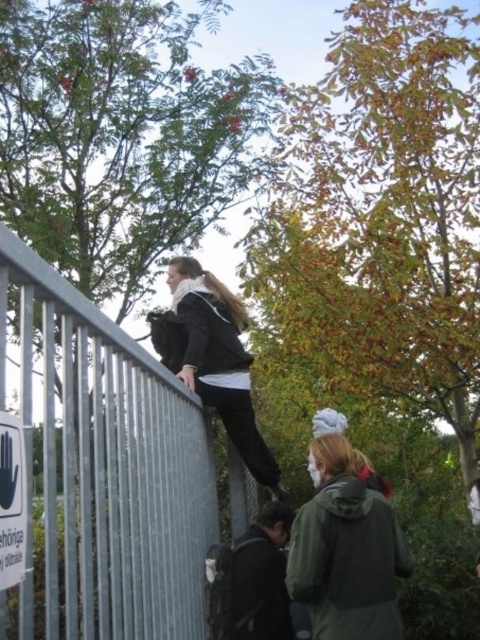
Who is positioned more to the left, metallic gray fence at upper left or green matte jacket at lower right?

Positioned to the left is metallic gray fence at upper left.

In the scene shown: Is metallic gray fence at upper left smaller than green matte jacket at lower right?

→ Actually, metallic gray fence at upper left might be larger than green matte jacket at lower right.

The height and width of the screenshot is (640, 480). What do you see at coordinates (108, 472) in the screenshot?
I see `metallic gray fence at upper left` at bounding box center [108, 472].

Where is `metallic gray fence at upper left`? Image resolution: width=480 pixels, height=640 pixels. metallic gray fence at upper left is located at coordinates (108, 472).

Who is higher up, metallic gray fence at upper left or matte black jacket at upper center?

matte black jacket at upper center is above.

The height and width of the screenshot is (640, 480). Describe the element at coordinates (108, 472) in the screenshot. I see `metallic gray fence at upper left` at that location.

Between point (64, 406) and point (211, 333), which one is positioned behind?

Point (211, 333)

The image size is (480, 640). I want to click on metallic gray fence at upper left, so click(x=108, y=472).

From the picture: Who is positioned more to the right, green matte jacket at lower right or matte black jacket at upper center?

Positioned to the right is green matte jacket at lower right.

From the picture: Is green matte jacket at lower right shorter than matte black jacket at upper center?

Yes.

What do you see at coordinates (346, 550) in the screenshot?
I see `green matte jacket at lower right` at bounding box center [346, 550].

Where is `green matte jacket at lower right`? This screenshot has width=480, height=640. green matte jacket at lower right is located at coordinates (346, 550).